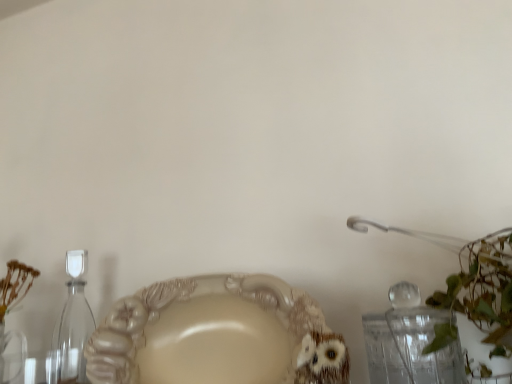
Question: Is matte beige plate at center situated inside transparent glass hourglass at left or outside?

Choices:
 (A) inside
 (B) outside

Answer: (B)

Question: From the image's perspective, is matte beige plate at center located above or below transparent glass hourglass at left?

Choices:
 (A) above
 (B) below

Answer: (A)

Question: Considering the positions of matte beige plate at center and transparent glass hourglass at left in the image, is matte beige plate at center wider or thinner than transparent glass hourglass at left?

Choices:
 (A) thin
 (B) wide

Answer: (B)

Question: In the image, is transparent glass hourglass at left positioned in front of or behind matte beige plate at center?

Choices:
 (A) behind
 (B) front

Answer: (A)

Question: Is transparent glass hourglass at left inside the boundaries of matte beige plate at center, or outside?

Choices:
 (A) outside
 (B) inside

Answer: (A)

Question: Is transparent glass hourglass at left bigger or smaller than matte beige plate at center?

Choices:
 (A) small
 (B) big

Answer: (A)

Question: Is transparent glass hourglass at left wider or thinner than matte beige plate at center?

Choices:
 (A) thin
 (B) wide

Answer: (A)